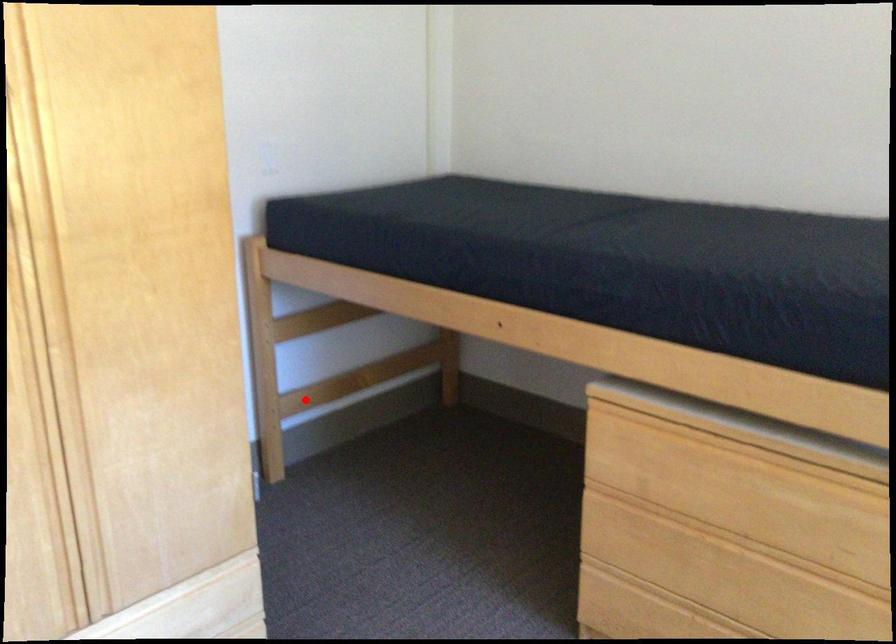
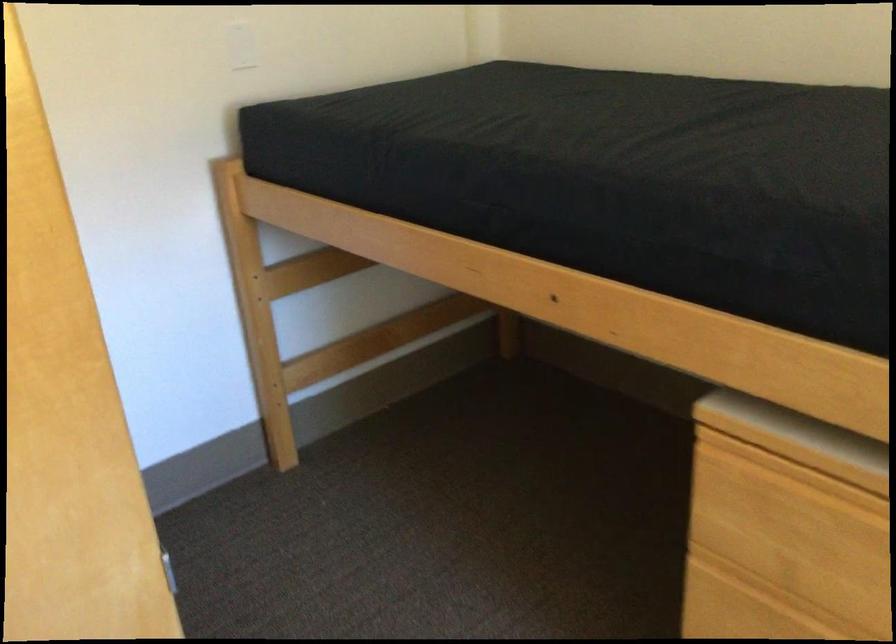
Find the pixel in the second image that matches the highlighted location in the first image.

(319, 368)